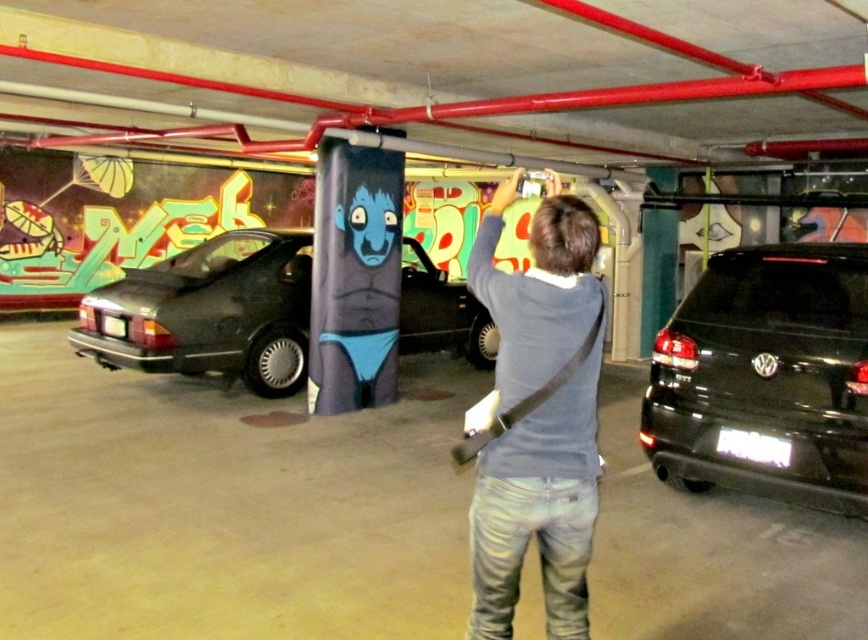
Question: Is dark blue sweater at center above black matte car at left?

Choices:
 (A) yes
 (B) no

Answer: (B)

Question: Estimate the real-world distances between objects in this image. Which object is farther from the dark blue sweater at center?

Choices:
 (A) black matte suv at right
 (B) black matte car at left

Answer: (B)

Question: Can you confirm if dark blue sweater at center is positioned to the right of black matte car at left?

Choices:
 (A) yes
 (B) no

Answer: (A)

Question: Considering the relative positions of dark blue sweater at center and black matte car at left in the image provided, where is dark blue sweater at center located with respect to black matte car at left?

Choices:
 (A) right
 (B) left

Answer: (A)

Question: Which point is farther to the camera?

Choices:
 (A) (490, 204)
 (B) (819, 490)
 (C) (293, 388)

Answer: (A)

Question: Which point is farther to the camera?

Choices:
 (A) black matte suv at right
 (B) black matte car at left
 (C) dark blue sweater at center

Answer: (B)